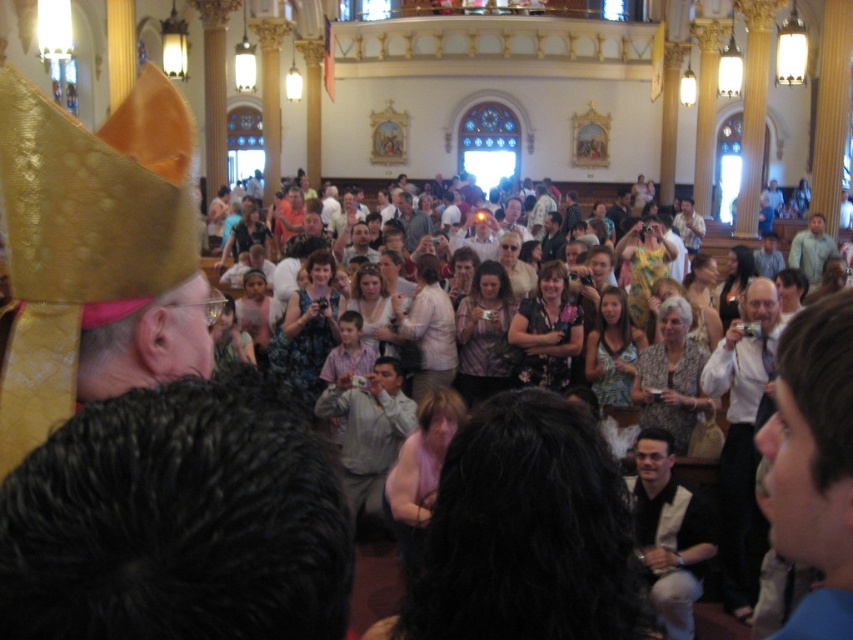
Is blue shirt at lower right shorter than light brown leather jacket at center?

No.

Measure the distance between blue shirt at lower right and camera.

A distance of 112.45 feet exists between blue shirt at lower right and camera.

In order to click on blue shirt at lower right in this screenshot , I will do `click(813, 464)`.

Looking at this image, who is more distant from viewer, (723,385) or (428,225)?

Positioned behind is point (428,225).

Is white shirt at center closer to camera compared to light brown leather jacket at center?

Yes, white shirt at center is in front of light brown leather jacket at center.

Does point (743, 484) lie in front of point (416, 209)?

Yes, it is.

What are the coordinates of `white shirt at center` in the screenshot? It's located at (741, 436).

Can you confirm if blue shirt at lower right is shorter than white textured vest at lower center?

Incorrect, blue shirt at lower right's height does not fall short of white textured vest at lower center's.

Which is more to the right, blue shirt at lower right or white textured vest at lower center?

blue shirt at lower right

Does point (816, 312) come closer to viewer compared to point (688, 522)?

Yes, point (816, 312) is closer to viewer.

Identify the location of blue shirt at lower right. (813, 464).